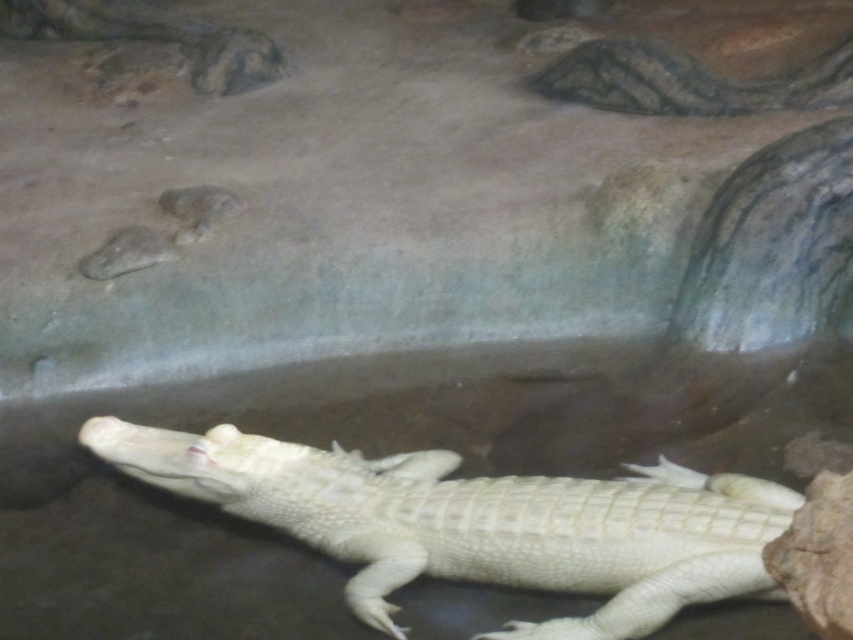
Is point (135, 461) more distant than point (614, 45)?

No, (135, 461) is in front of (614, 45).

This screenshot has width=853, height=640. What do you see at coordinates (480, 522) in the screenshot?
I see `smooth white crocodile at center` at bounding box center [480, 522].

This screenshot has height=640, width=853. I want to click on smooth white crocodile at center, so click(480, 522).